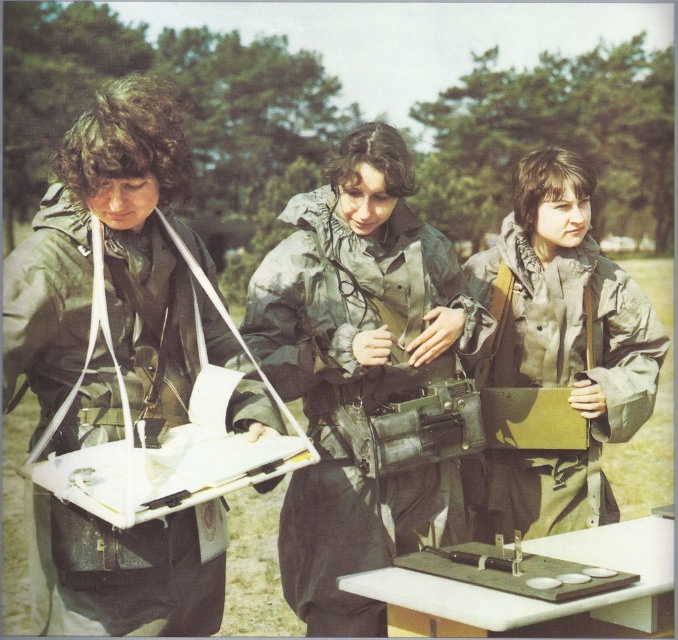
You are a military trainer observing the group. You need to determine which jacket is shorter between the matte green jacket at left and the green matte jacket at center. Which one should you report?

The matte green jacket at left is shorter than the green matte jacket at center, so you should report that the matte green jacket at left is the shorter one.